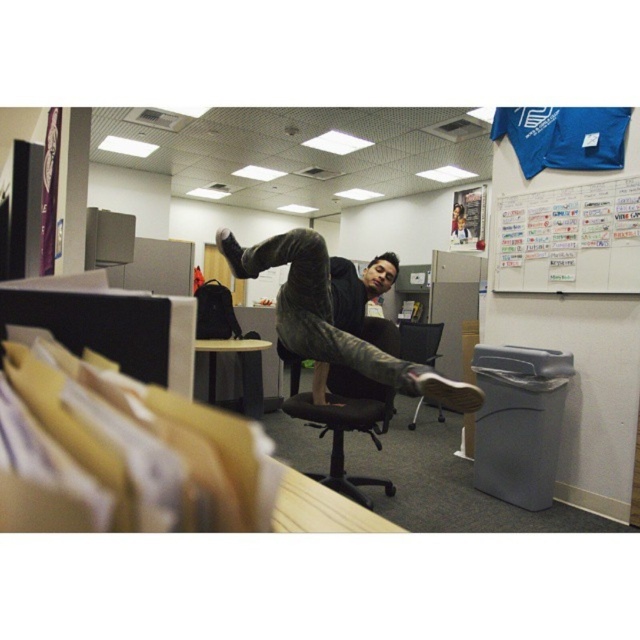
You are navigating through an office cubicle maze and need to reach a document placed at point (253, 346). You are currently at point (618, 278). According to the image, which direction should you move to get closer to your destination?

Point (618, 278) is in front of point (253, 346), so you should move backward to reach the document at point (253, 346).

In the office scene, there are dark gray jeans at center and a wooden table at center. From the perspective of someone standing at the entrance of the cubicle, which object is positioned to the right?

The dark gray jeans at center are to the right of the wooden table at center, so from the entrance perspective, the dark gray jeans at center would be on the right side.